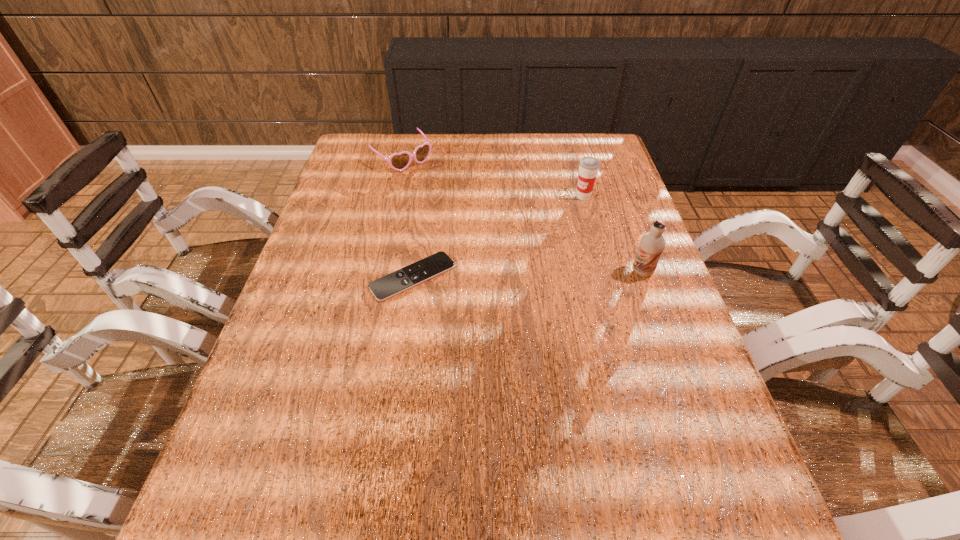
In the image, there is a desktop. Where is `vacant space at the left edge`? This screenshot has width=960, height=540. vacant space at the left edge is located at coordinates 240,414.

The width and height of the screenshot is (960, 540). I want to click on vacant region at the right edge of the desktop, so click(x=605, y=218).

Identify the location of vacant region at the far left corner of the desktop. (348, 145).

Locate an element on the screen. This screenshot has height=540, width=960. vacant space at the far right corner is located at coordinates (593, 156).

Image resolution: width=960 pixels, height=540 pixels. I want to click on empty location between the chocolate milk and the sunglasses, so click(x=522, y=215).

Where is `free space between the shortest object and the sunglasses`? This screenshot has height=540, width=960. free space between the shortest object and the sunglasses is located at coordinates (407, 218).

At what (x,y) coordinates should I click in order to perform the action: click on free space between the third tallest object and the rightmost object. Please return your answer as a coordinate pair (x, y). This screenshot has width=960, height=540. Looking at the image, I should click on (522, 215).

The width and height of the screenshot is (960, 540). I want to click on free spot between the farthest object and the second object from right to left, so click(x=492, y=178).

At what (x,y) coordinates should I click in order to perform the action: click on free space between the remote control and the farthest object. Please return your answer as a coordinate pair (x, y). The height and width of the screenshot is (540, 960). Looking at the image, I should click on (407, 218).

This screenshot has width=960, height=540. I want to click on empty space between the shortest object and the third nearest object, so [498, 237].